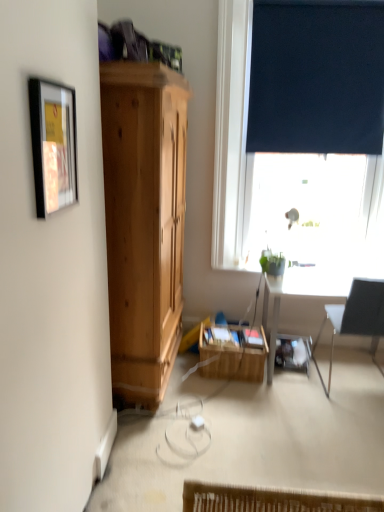
What is the approximate height of dark blue roller blind at upper right?

dark blue roller blind at upper right is 1.95 meters in height.

Describe the element at coordinates (53, 145) in the screenshot. I see `matte black picture frame at upper left` at that location.

What are the coordinates of `black fabric chair at right` in the screenshot? It's located at (356, 318).

Describe the element at coordinates (272, 263) in the screenshot. I see `green matte plant at window` at that location.

You are a GUI agent. You are given a task and a screenshot of the screen. Output one action in this format:
    pyautogui.click(x=<x>, y=<y>)
    Task: Click on the dark blue roller blind at upper right
    
    Given the screenshot: What is the action you would take?
    pyautogui.click(x=231, y=134)

From the image's perspective, relative to woven wood basket at center, is dark blue fabric at upper right above or below?

dark blue fabric at upper right is above woven wood basket at center.

Is dark blue fabric at upper right far from woven wood basket at center?

dark blue fabric at upper right is far away from woven wood basket at center.

Could you tell me if dark blue fabric at upper right is facing woven wood basket at center?

No, dark blue fabric at upper right does not turn towards woven wood basket at center.

Based on the photo, is black fabric chair at right a part of woven wood basket at center?

No, black fabric chair at right is located outside of woven wood basket at center.

Considering the relative sizes of woven wood basket at center and black fabric chair at right in the image provided, is woven wood basket at center bigger than black fabric chair at right?

Actually, woven wood basket at center might be smaller than black fabric chair at right.

Is woven wood basket at center directly adjacent to black fabric chair at right?

They are not placed beside each other.

From a real-world perspective, which is physically above, woven wood basket at center or black fabric chair at right?

black fabric chair at right is physically above.

Is matte black picture frame at upper left positioned with its back to dark blue roller blind at upper right?

No, dark blue roller blind at upper right is not at the back of matte black picture frame at upper left.

Considering the positions of objects matte black picture frame at upper left and dark blue roller blind at upper right in the image provided, who is more to the left, matte black picture frame at upper left or dark blue roller blind at upper right?

From the viewer's perspective, matte black picture frame at upper left appears more on the left side.

Is matte black picture frame at upper left taller or shorter than dark blue roller blind at upper right?

Considering their sizes, matte black picture frame at upper left has less height than dark blue roller blind at upper right.

Consider the image. Which object is closer to the camera, black fabric chair at right or woven wood basket at center?

black fabric chair at right is more forward.

Where is `chair lying in front of the woven wood basket at center`? chair lying in front of the woven wood basket at center is located at coordinates (356, 318).

Can you confirm if black fabric chair at right is wider than woven wood basket at center?

Indeed, black fabric chair at right has a greater width compared to woven wood basket at center.

From the image's perspective, between black fabric chair at right and woven wood basket at center, which one is located above?

black fabric chair at right is shown above in the image.

Is matte black picture frame at upper left positioned with its back to woven wood basket at center?

That's not correct — matte black picture frame at upper left is not looking away from woven wood basket at center.

Is matte black picture frame at upper left smaller than woven wood basket at center?

Yes.

Is there a large distance between matte black picture frame at upper left and woven wood basket at center?

Yes, matte black picture frame at upper left and woven wood basket at center are quite far apart.

Consider the image. Considering the positions of objects matte black picture frame at upper left and woven wood basket at center in the image provided, who is more to the right, matte black picture frame at upper left or woven wood basket at center?

Positioned to the right is woven wood basket at center.

From the image's perspective, which is below, woven wood basket at center or matte black picture frame at upper left?

From the image's view, woven wood basket at center is below.

Who is taller, woven wood basket at center or matte black picture frame at upper left?

matte black picture frame at upper left is taller.

From the picture: Is the surface of woven wood basket at center in direct contact with matte black picture frame at upper left?

woven wood basket at center and matte black picture frame at upper left are clearly separated.

How many degrees apart are the facing directions of woven wood basket at center and matte black picture frame at upper left?

The angular difference between woven wood basket at center and matte black picture frame at upper left is 0.422 degrees.

Does matte black picture frame at upper left have a greater width compared to black fabric chair at right?

No, matte black picture frame at upper left is not wider than black fabric chair at right.

Which point is more distant from viewer, (59, 104) or (353, 301)?

The point (353, 301) is farther.

Is matte black picture frame at upper left to the left of black fabric chair at right from the viewer's perspective?

Correct, you'll find matte black picture frame at upper left to the left of black fabric chair at right.

At what (x,y) coordinates should I click in order to perform the action: click on picture frame lying above the black fabric chair at right (from the image's perspective). Please return your answer as a coordinate pair (x, y). This screenshot has height=512, width=384. Looking at the image, I should click on (53, 145).

Identify the location of curtain located on the right of woven wood basket at center. The image size is (384, 512). (316, 77).

This screenshot has height=512, width=384. What are the coordinates of `chair that appears above the woven wood basket at center (from a real-world perspective)` in the screenshot? It's located at (356, 318).

Based on their spatial positions, is black fabric chair at right or matte black picture frame at upper left further from dark blue fabric at upper right?

matte black picture frame at upper left is further to dark blue fabric at upper right.

From the image, which object appears to be farther from green matte plant at window, woven wood basket at center or matte black picture frame at upper left?

Based on the image, matte black picture frame at upper left appears to be further to green matte plant at window.

Estimate the real-world distances between objects in this image. Which object is further from dark blue fabric at upper right, woven wood basket at center or dark blue roller blind at upper right?

woven wood basket at center.

Which object lies further to the anchor point dark blue roller blind at upper right, dark blue fabric at upper right or black fabric chair at right?

black fabric chair at right is positioned further to the anchor dark blue roller blind at upper right.

When comparing their distances from dark blue roller blind at upper right, does black fabric chair at right or matte black picture frame at upper left seem closer?

Among the two, black fabric chair at right is located nearer to dark blue roller blind at upper right.

When comparing their distances from black fabric chair at right, does woven wood basket at center or dark blue roller blind at upper right seem further?

dark blue roller blind at upper right is further to black fabric chair at right.

Based on their spatial positions, is woven wood basket at center or green matte plant at window closer to dark blue fabric at upper right?

Based on the image, green matte plant at window appears to be nearer to dark blue fabric at upper right.

From the picture: Considering their positions, is matte black picture frame at upper left positioned closer to woven wood basket at center than green matte plant at window?

green matte plant at window lies closer to woven wood basket at center than the other object.

Identify the location of window between matte black picture frame at upper left and black fabric chair at right in the horizontal direction. The width and height of the screenshot is (384, 512). (231, 134).

Where is `window that lies between dark blue fabric at upper right and green matte plant at window from top to bottom`? This screenshot has height=512, width=384. window that lies between dark blue fabric at upper right and green matte plant at window from top to bottom is located at coordinates (231, 134).

Find the location of a particular element. plant between dark blue roller blind at upper right and black fabric chair at right vertically is located at coordinates (272, 263).

Where is `window between dark blue fabric at upper right and woven wood basket at center in the up-down direction`? The width and height of the screenshot is (384, 512). window between dark blue fabric at upper right and woven wood basket at center in the up-down direction is located at coordinates (231, 134).